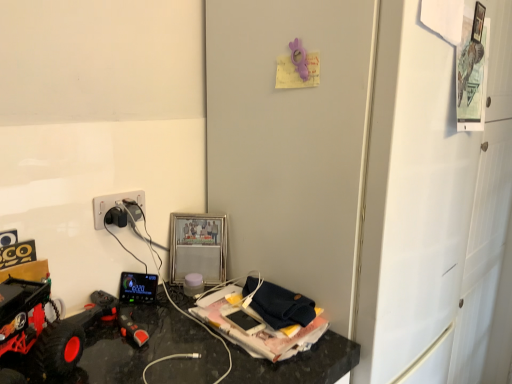
Question: From the image's perspective, is rubberized black toy car at lower left beneath matte white cup at center, placed as the second toy when sorted from bottom to top?

Choices:
 (A) yes
 (B) no

Answer: (A)

Question: Would you consider rubberized black toy car at lower left to be distant from matte white cup at center, the second toy viewed from the left?

Choices:
 (A) yes
 (B) no

Answer: (B)

Question: Is rubberized black toy car at lower left closer to the viewer compared to matte white cup at center, positioned as the 1th toy in back-to-front order?

Choices:
 (A) yes
 (B) no

Answer: (A)

Question: Is rubberized black toy car at lower left oriented away from matte white cup at center, which is the third toy from front to back?

Choices:
 (A) yes
 (B) no

Answer: (B)

Question: Is rubberized black toy car at lower left outside matte white cup at center, which is counted as the second toy, starting from the right?

Choices:
 (A) yes
 (B) no

Answer: (A)

Question: In terms of height, does matte white cup at center, placed as the second toy when sorted from bottom to top, look taller or shorter compared to black plastic power plugs and sockets at left?

Choices:
 (A) short
 (B) tall

Answer: (A)

Question: From a real-world perspective, is matte white cup at center, positioned as the 1th toy in back-to-front order, above or below black plastic power plugs and sockets at left?

Choices:
 (A) below
 (B) above

Answer: (A)

Question: Based on their positions, is matte white cup at center, which is counted as the second toy, starting from the right, located to the left or right of black plastic power plugs and sockets at left?

Choices:
 (A) right
 (B) left

Answer: (A)

Question: From the image's perspective, is matte white cup at center, placed as the second toy when sorted from bottom to top, positioned above or below black plastic power plugs and sockets at left?

Choices:
 (A) above
 (B) below

Answer: (B)

Question: From the image's perspective, is matte white cup at center, positioned as the 1th toy in back-to-front order, positioned above or below rubberized black toy car at lower left?

Choices:
 (A) below
 (B) above

Answer: (B)

Question: Do you think matte white cup at center, which is counted as the second toy, starting from the right, is within rubberized black toy car at lower left, or outside of it?

Choices:
 (A) outside
 (B) inside

Answer: (A)

Question: Considering the positions of point (185, 284) and point (38, 327), is point (185, 284) closer or farther from the camera than point (38, 327)?

Choices:
 (A) closer
 (B) farther

Answer: (B)

Question: Is matte white cup at center, placed as the second toy when sorted from bottom to top, bigger or smaller than rubberized black toy car at lower left?

Choices:
 (A) small
 (B) big

Answer: (A)

Question: From the image's perspective, is rubberized black remote control at lower left, arranged as the third toy when viewed from the top, located above or below matte white cup at center, which is counted as the second toy, starting from the right?

Choices:
 (A) above
 (B) below

Answer: (B)

Question: Is rubberized black remote control at lower left, arranged as the third toy when viewed from the top, bigger or smaller than matte white cup at center, which is the third toy from front to back?

Choices:
 (A) big
 (B) small

Answer: (A)